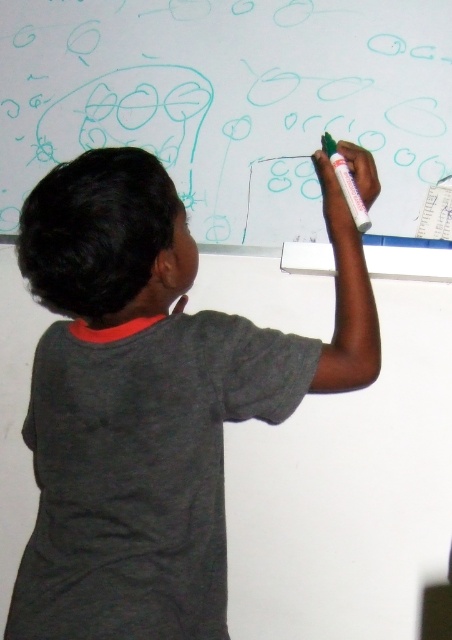
You are an art student who needs to draw a new pattern on the whiteboard at upper center using the green matte marker at upper center. Based on their positions, which object should you reach for first?

The green matte marker at upper center is to the right of the whiteboard at upper center, so you should reach for the green matte marker at upper center first to use it on the whiteboard.